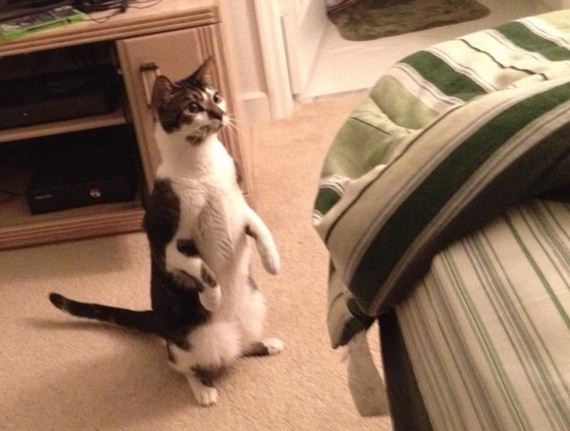
Identify the location of floor. (52, 350).